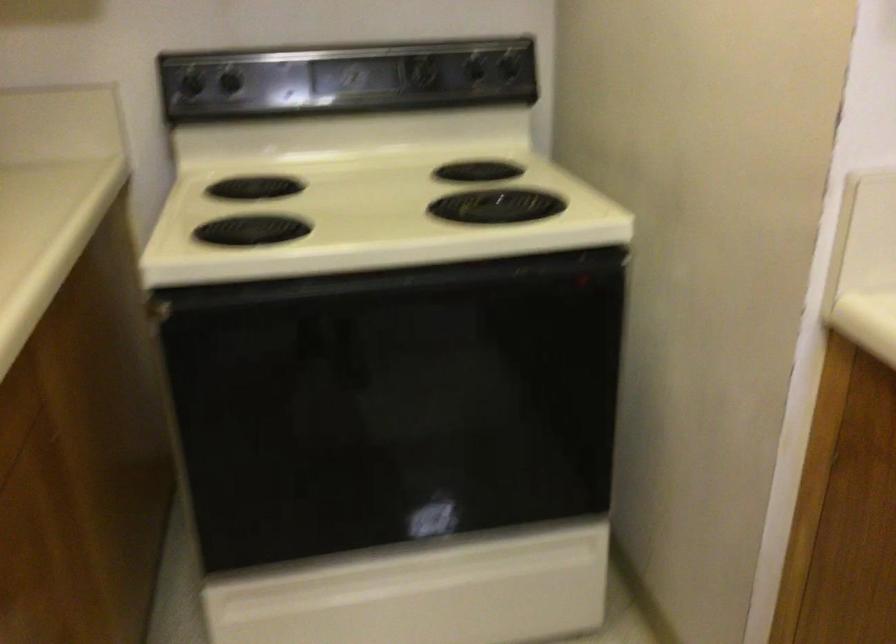
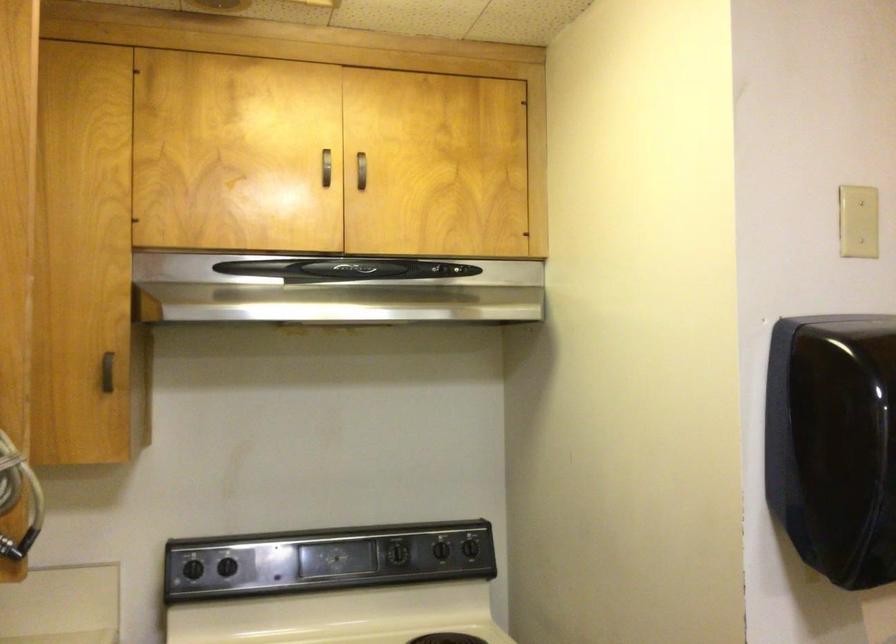
The point at [187,86] is marked in the first image. Where is the corresponding point in the second image?

(193, 569)